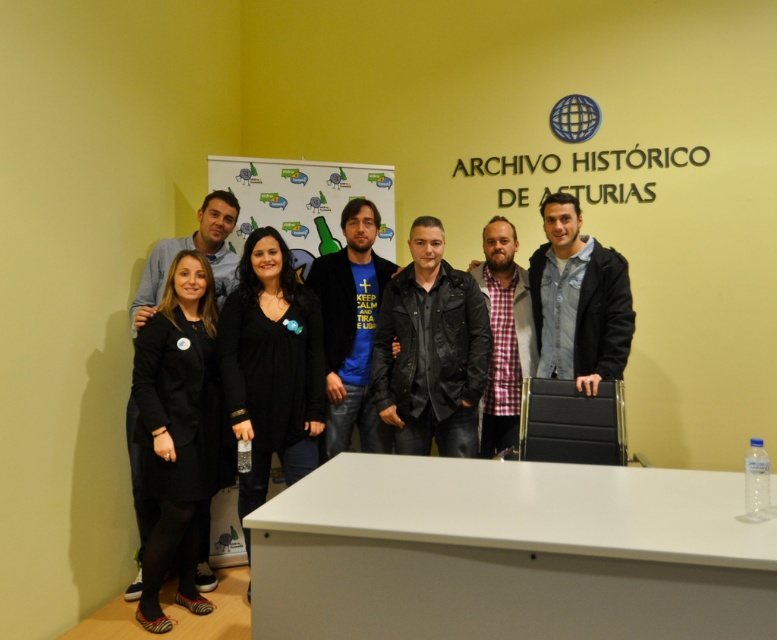
Is point (295, 221) more distant than point (385, 449)?

Yes.

What do you see at coordinates (302, 202) in the screenshot? I see `matte plastic bulletin board at center` at bounding box center [302, 202].

This screenshot has width=777, height=640. Describe the element at coordinates (302, 202) in the screenshot. I see `matte plastic bulletin board at center` at that location.

Identify the location of matte plastic bulletin board at center. coord(302,202).

Describe the element at coordinates (176, 429) in the screenshot. The image size is (777, 640). I see `black matte coat at left` at that location.

Is black matte coat at left taller than blue t-shirt at center?

Correct, black matte coat at left is much taller as blue t-shirt at center.

This screenshot has height=640, width=777. I want to click on black matte coat at left, so click(176, 429).

Identify the location of black matte coat at left. This screenshot has height=640, width=777. (176, 429).

Which of these two, black matte dress at center or blue t-shirt at center, stands shorter?

blue t-shirt at center

The image size is (777, 640). I want to click on black matte dress at center, so click(x=270, y=365).

Where is `black matte dress at center`? black matte dress at center is located at coordinates (270, 365).